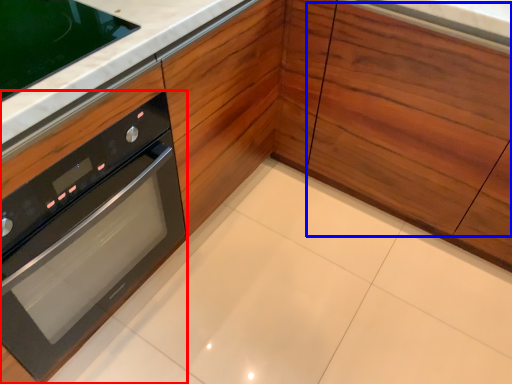
Question: Which of the following is the farthest to the observer, oven (highlighted by a red box) or drawer (highlighted by a blue box)?

Choices:
 (A) oven
 (B) drawer

Answer: (B)